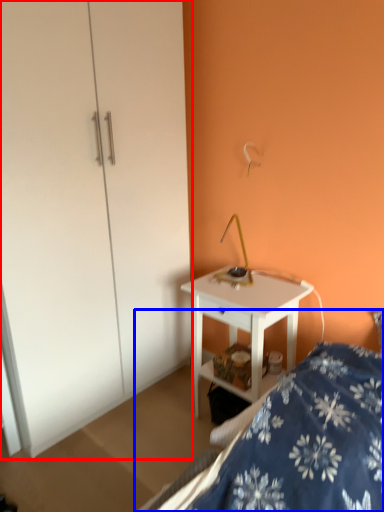
Question: Which object appears farthest to the camera in this image, dresser (highlighted by a red box) or bed (highlighted by a blue box)?

Choices:
 (A) dresser
 (B) bed

Answer: (A)